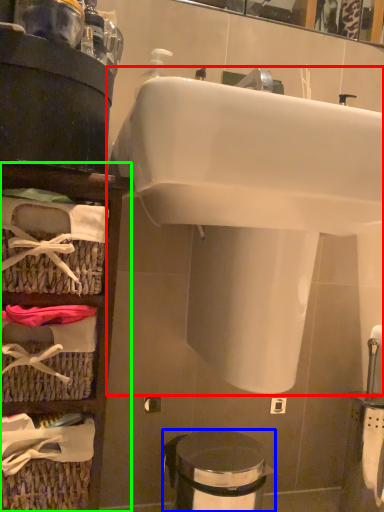
Question: Which object is positioned farthest from sink (highlighted by a red box)? Select from trash bin/can (highlighted by a blue box) and shelf (highlighted by a green box).

Choices:
 (A) trash bin/can
 (B) shelf

Answer: (A)